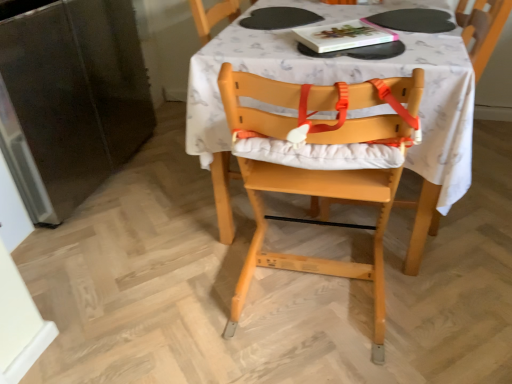
Question: Is point (429, 92) positioned closer to the camera than point (381, 221)?

Choices:
 (A) farther
 (B) closer

Answer: (B)

Question: Is white fabric table at center in front of or behind natural wood highchair at center in the image?

Choices:
 (A) front
 (B) behind

Answer: (B)

Question: Estimate the real-world distances between objects in this image. Which object is closer to the white fabric table at center?

Choices:
 (A) hardcover book at upper center
 (B) natural wood highchair at center

Answer: (B)

Question: Considering the real-world distances, which object is closest to the hardcover book at upper center?

Choices:
 (A) white fabric table at center
 (B) natural wood highchair at center

Answer: (A)